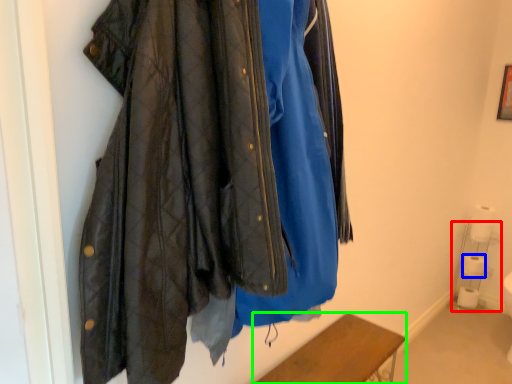
Question: Which is nearer to the shelf (highlighted by a red box)? toilet paper (highlighted by a blue box) or furniture (highlighted by a green box).

Choices:
 (A) toilet paper
 (B) furniture

Answer: (A)